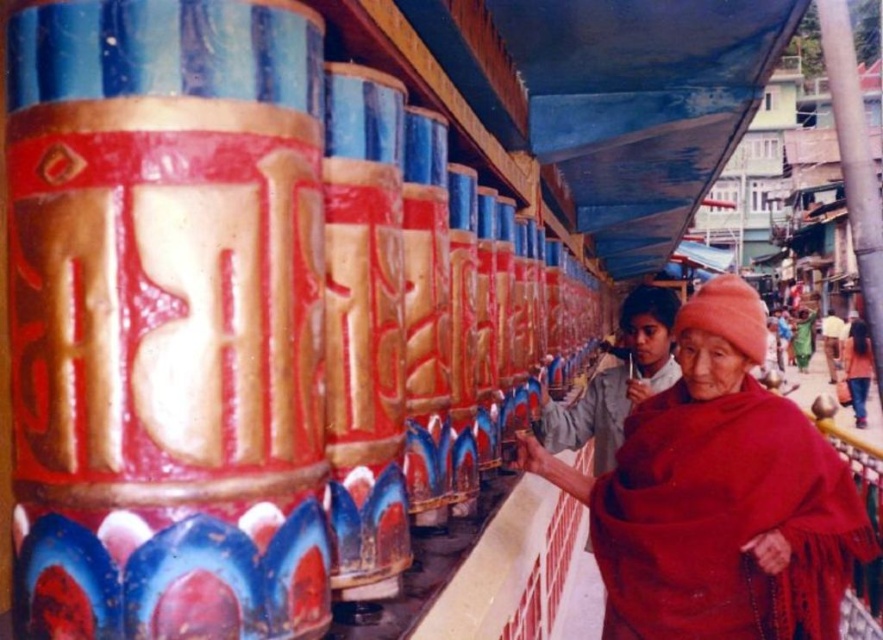
You are standing at the center of the prayer wheel installation. You see a point marked at coordinates (723, 520). Which object is located at that point?

The point at coordinates (723, 520) indicates the red woolen robe at lower right.

You are standing at the center of the prayer wheel installation. There is a point marked at coordinates (589, 417). Which object is located at this point?

The point at coordinates (589, 417) corresponds to the red woolen robe at right.